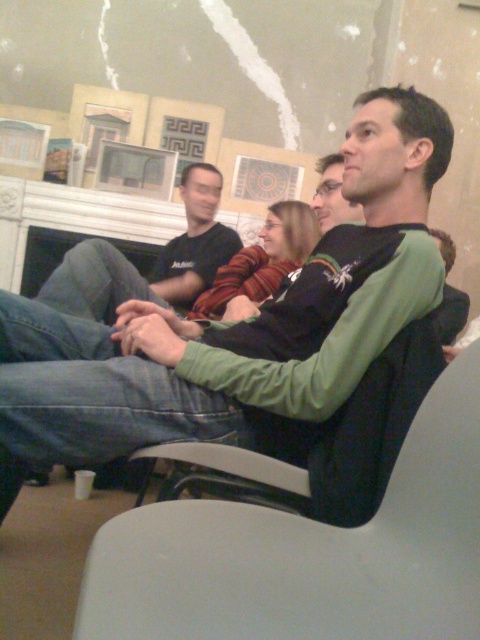
You are an interior designer assessing the space. You notice the green fleece sweater at center and the white plastic swivel chair at lower center. Which object takes up more space in the room?

The green fleece sweater at center takes up more space in the room as it is bigger than the white plastic swivel chair at lower center.

You are standing in the living room and need to move the black cotton shirt at upper center to a higher shelf. Can you place it above the white plastic swivel chair at lower center?

The white plastic swivel chair at lower center is below the black cotton shirt at upper center, so yes, you can place the black cotton shirt at upper center above the white plastic swivel chair at lower center.

You are planning to place a new rectangular table that is 1 meter wide in the living room. You see the white plastic swivel chair at lower center and the black cotton shirt at upper center. Which object is wider, and will the table fit between them?

The white plastic swivel chair at lower center is wider than the black cotton shirt at upper center. Since the table is 1 meter wide, it depends on the distance between them. However, the description only provides information about their widths, not the space between them. Please check the actual distance between the two objects to determine if the table will fit.